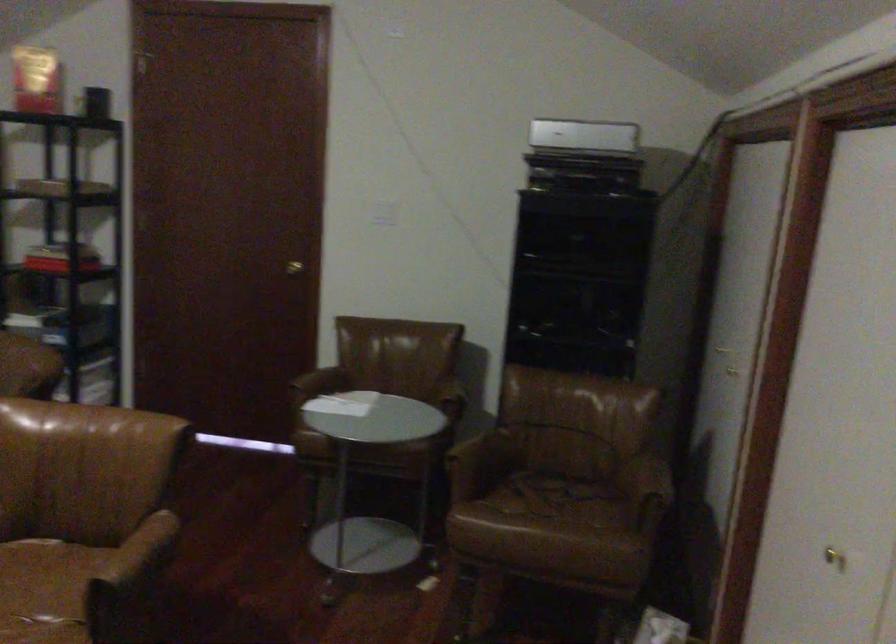
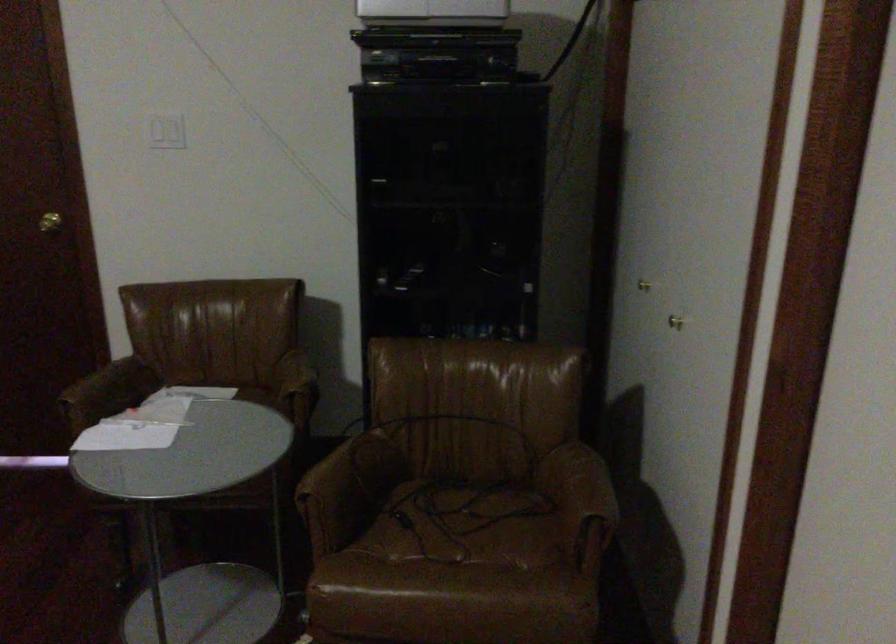
Locate, in the second image, the point that corresponds to (x=451, y=471) in the first image.

(312, 513)